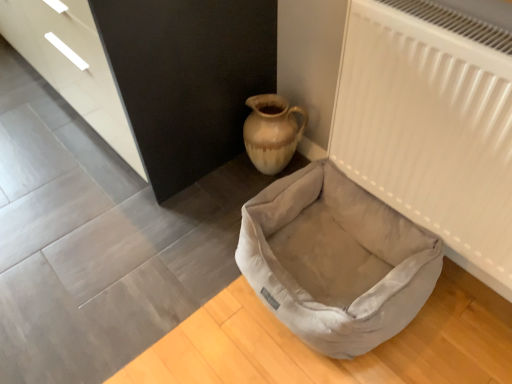
Find the location of a particular element. free location to the left of velvet beige dog bed at lower center is located at coordinates (174, 279).